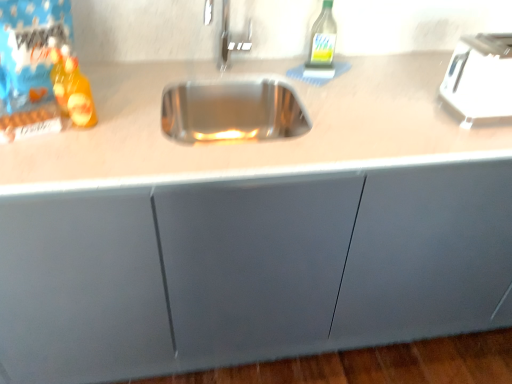
Question: Is translucent plastic bottle at left, which is the 1th bottle from left to right, smaller than white plastic toaster at upper right?

Choices:
 (A) no
 (B) yes

Answer: (B)

Question: Is white plastic toaster at upper right completely or partially inside translucent plastic bottle at left, marked as the first bottle in a front-to-back arrangement?

Choices:
 (A) yes
 (B) no

Answer: (B)

Question: Is translucent plastic bottle at left, which is the second bottle in top-to-bottom order, oriented away from white plastic toaster at upper right?

Choices:
 (A) no
 (B) yes

Answer: (A)

Question: Can you confirm if translucent plastic bottle at left, the 2th bottle from the right, is thinner than white plastic toaster at upper right?

Choices:
 (A) no
 (B) yes

Answer: (B)

Question: Is translucent plastic bottle at left, which is the second bottle in top-to-bottom order, taller than white plastic toaster at upper right?

Choices:
 (A) yes
 (B) no

Answer: (A)

Question: Can you confirm if translucent plastic bottle at left, which is the 1th bottle from left to right, is bigger than white plastic toaster at upper right?

Choices:
 (A) no
 (B) yes

Answer: (A)

Question: Is translucent plastic bottle at left, marked as the first bottle in a bottom-to-top arrangement, positioned behind green glass bottle at upper right, which appears as the second bottle when ordered from the bottom?

Choices:
 (A) yes
 (B) no

Answer: (B)

Question: Is translucent plastic bottle at left, the second bottle from the back, oriented towards green glass bottle at upper right, which ranks as the second bottle in left-to-right order?

Choices:
 (A) no
 (B) yes

Answer: (A)

Question: Is translucent plastic bottle at left, the second bottle from the back, located outside green glass bottle at upper right, which is the first bottle in back-to-front order?

Choices:
 (A) yes
 (B) no

Answer: (A)

Question: Is translucent plastic bottle at left, the second bottle from the back, oriented away from green glass bottle at upper right, which ranks as the 1th bottle in top-to-bottom order?

Choices:
 (A) yes
 (B) no

Answer: (B)

Question: From a real-world perspective, is translucent plastic bottle at left, the 2th bottle from the right, beneath green glass bottle at upper right, which ranks as the second bottle in front-to-back order?

Choices:
 (A) no
 (B) yes

Answer: (B)

Question: Does translucent plastic bottle at left, the 2th bottle from the right, have a lesser width compared to green glass bottle at upper right, which is the first bottle in back-to-front order?

Choices:
 (A) yes
 (B) no

Answer: (A)

Question: Can you confirm if green glass bottle at upper right, which ranks as the second bottle in front-to-back order, is wider than translucent plastic bottle at left, marked as the first bottle in a bottom-to-top arrangement?

Choices:
 (A) yes
 (B) no

Answer: (A)